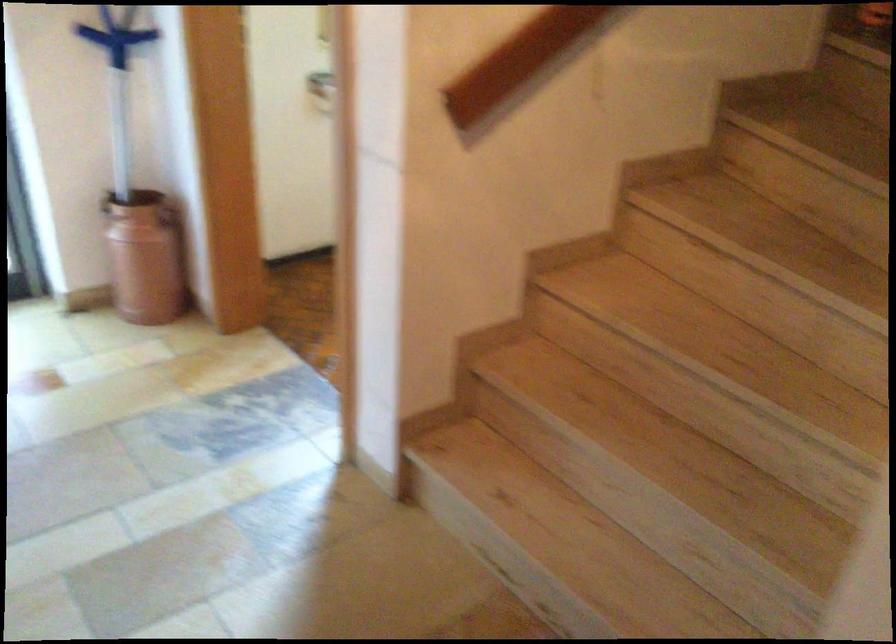
Find where to grasp the wooden stair handrail. Please return your answer as a coordinate pair (x, y).

(518, 61)